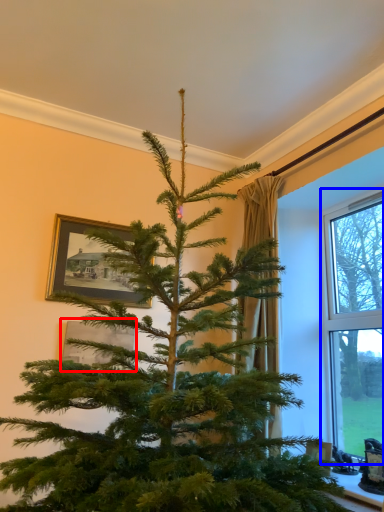
Question: Among these objects, which one is farthest to the camera, picture frame (highlighted by a red box) or window (highlighted by a blue box)?

Choices:
 (A) picture frame
 (B) window

Answer: (A)